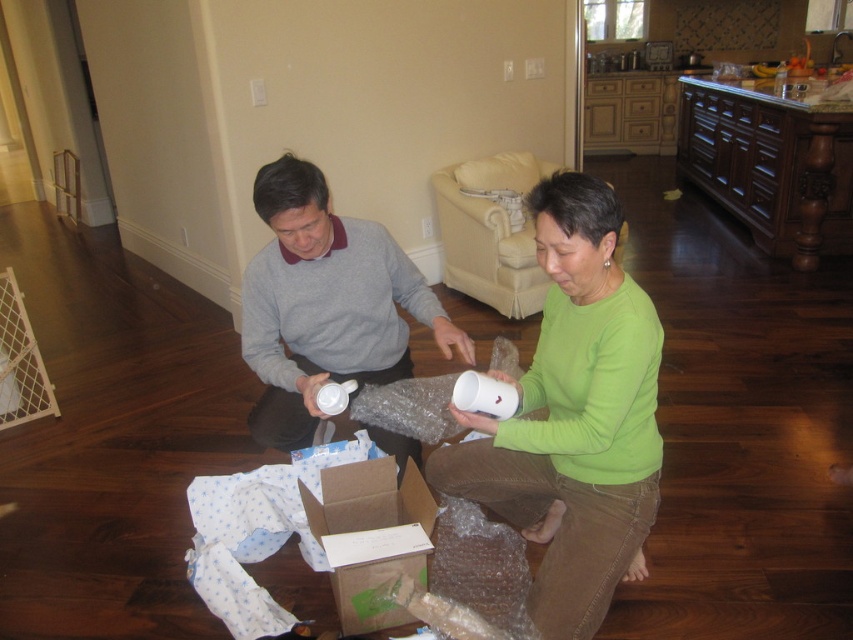
You are standing in the living room and want to place a small decorative item between the two points labeled point (552, 486) and point (378, 625). Based on their positions, which point is closer to you when facing the scene?

Point (552, 486) is in front of point (378, 625), so when facing the scene, point (552, 486) will be closer to you.

You are an interior designer analyzing the layout of this living room. The gray matte sweater at center is placed at coordinates 0.475, 0.382. If you want to place a decorative pillow exactly 0.1 units to the right of this sweater, what would be the new coordinates?

The new coordinates would be (325, 368) since adding 0.1 to the x coordinate of the gray matte sweater at center at 0.475 gives 0.575 while keeping the y coordinate the same.